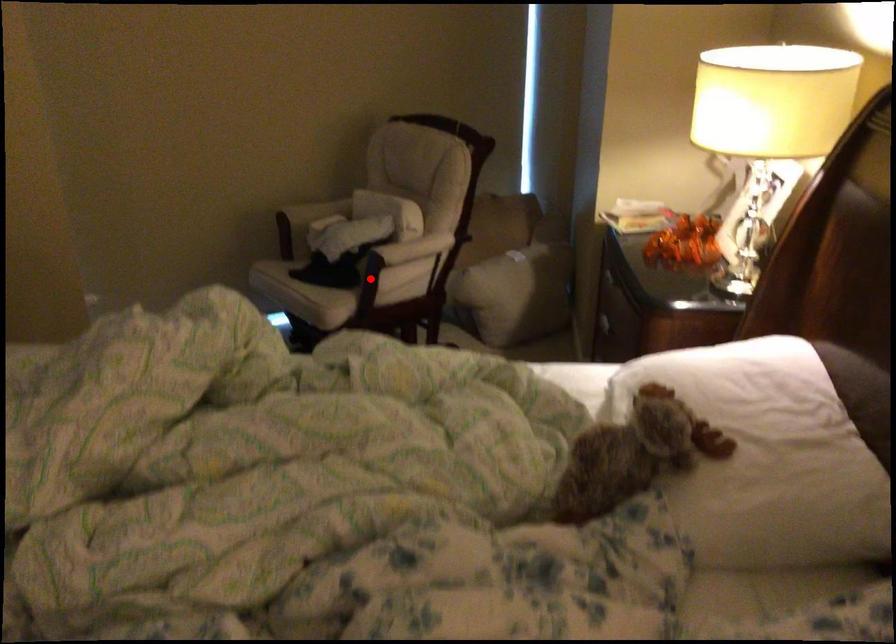
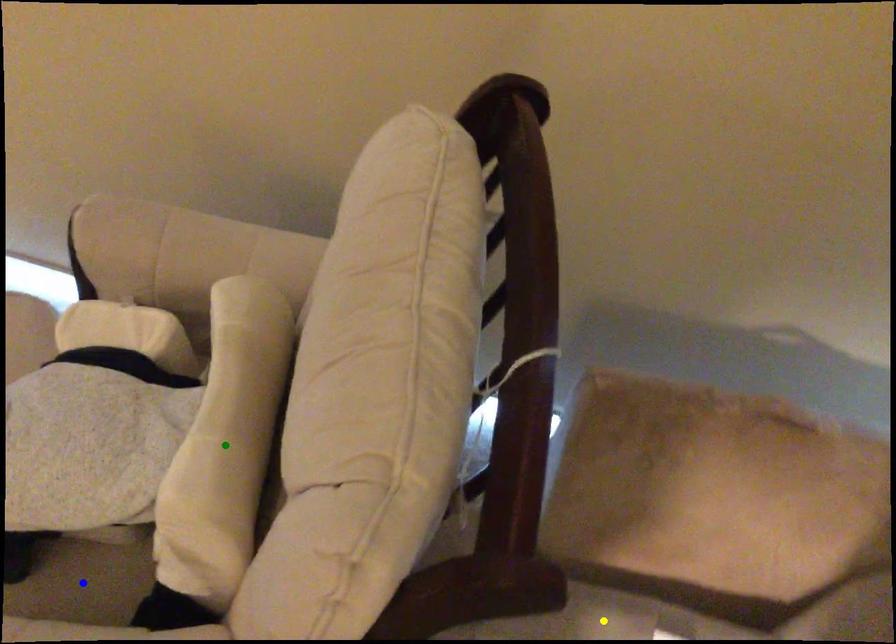
Question: I am providing you with two images of the same scene from different viewpoints. A red point is marked on the first image. You are given multiple points on the second image. In image 2, which mark is for the same physical point as the one in image 1?

Choices:
 (A) yellow point
 (B) green point
 (C) blue point

Answer: (C)